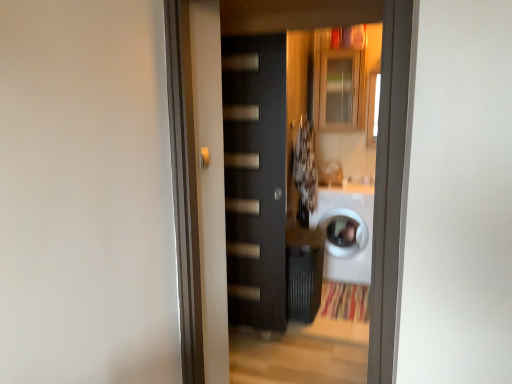
You are a GUI agent. You are given a task and a screenshot of the screen. Output one action in this format:
    pyautogui.click(x=<x>, y=<y>)
    Task: Click on the vacant space situated above matte black door at center (from a real-world perspective)
    This screenshot has width=512, height=384.
    Given the screenshot: What is the action you would take?
    pyautogui.click(x=249, y=31)